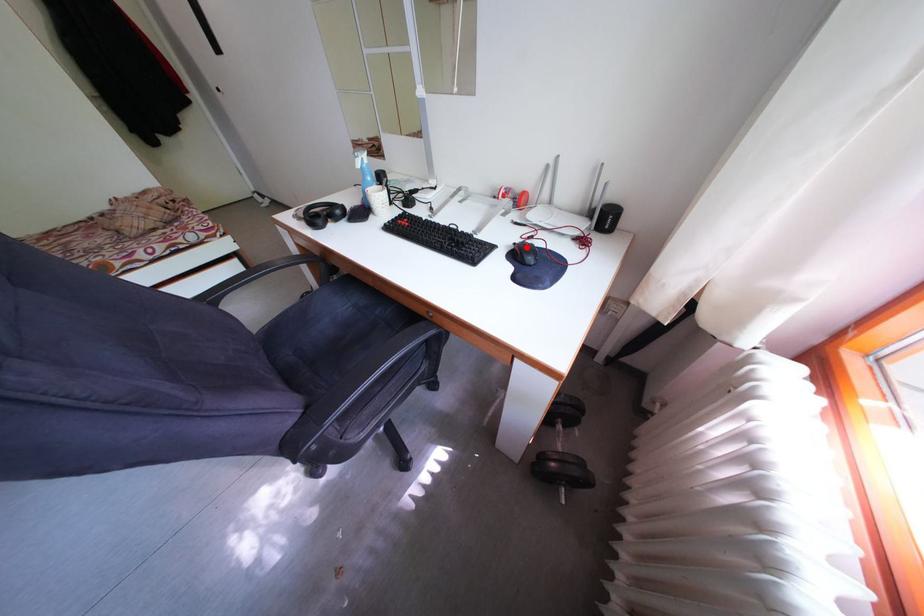
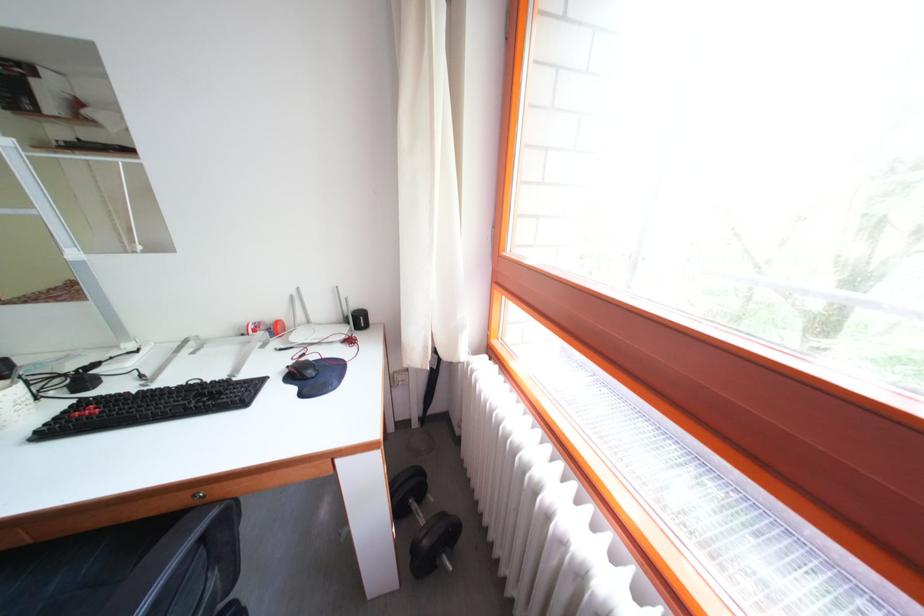
Where in the second image is the point corresponding to the highlighted location from the first image?

(298, 370)